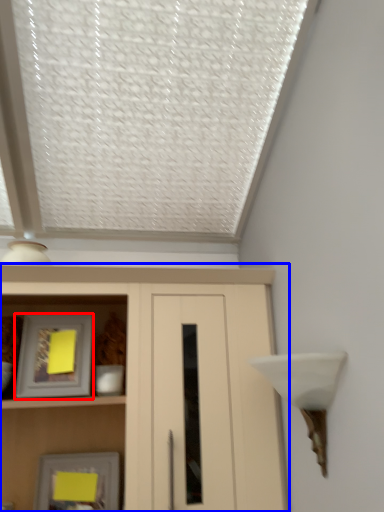
Question: Which of the following is the closest to the observer, picture frame (highlighted by a red box) or cupboard (highlighted by a blue box)?

Choices:
 (A) picture frame
 (B) cupboard

Answer: (B)